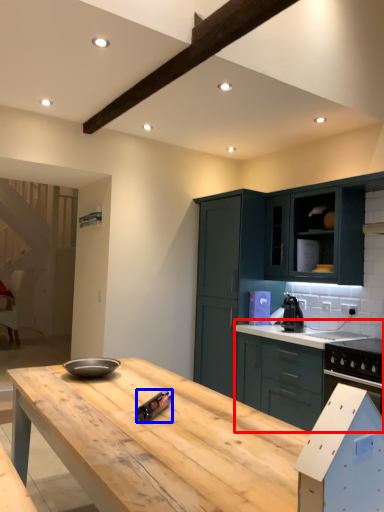
Question: Which object appears farthest to the camera in this image, cabinetry (highlighted by a red box) or appliance (highlighted by a blue box)?

Choices:
 (A) cabinetry
 (B) appliance

Answer: (A)